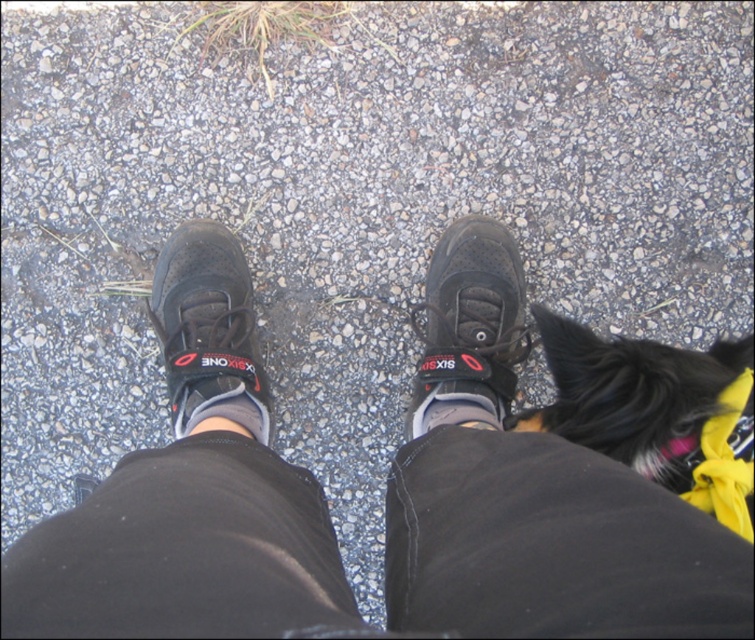
Question: Which point appears farthest from the camera in this image?

Choices:
 (A) (467, 253)
 (B) (472, 420)

Answer: (A)

Question: Does matte black sneaker at left appear over white fabric sock at center?

Choices:
 (A) yes
 (B) no

Answer: (A)

Question: Among these objects, which one is farthest from the camera?

Choices:
 (A) white fabric sock at center
 (B) black fuzzy dog at lower right
 (C) matte black shoe at center
 (D) matte black sneaker at left

Answer: (D)

Question: Where is black mesh sneakers at center located in relation to white fabric sock at center in the image?

Choices:
 (A) right
 (B) left

Answer: (B)

Question: Does black fuzzy dog at lower right appear on the left side of matte black shoe at center?

Choices:
 (A) yes
 (B) no

Answer: (B)

Question: Estimate the real-world distances between objects in this image. Which object is farther from the matte black shoe at center?

Choices:
 (A) black mesh sneakers at center
 (B) white fabric sock at center

Answer: (A)